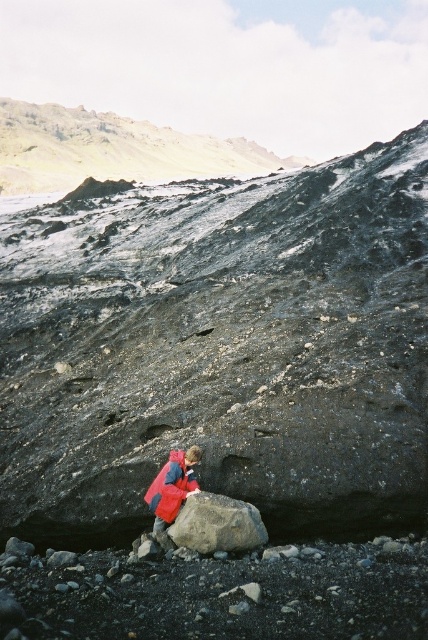
You are a photographer trying to capture a clear shot of the red matte jacket at center and the dark gray rocky cliff at upper center. However, the cliff is partially blocking your view of the jacket. Can you adjust your position to see both objects clearly without any obstruction?

The red matte jacket at center is behind the dark gray rocky cliff at upper center, so moving your position slightly to the side or adjusting the angle of your camera could allow you to see both objects without obstruction.

You are a photographer standing at the center of the scene. You want to take a photo that includes both the point at coordinates (35, 428) and the point at (222, 504). Which point should you focus on to ensure both are in sharp focus?

You should focus on the point at (222, 504) because it is closer to the camera than the point at (35, 428). By focusing on the closer point, the depth of field will likely include both points in sharp focus.